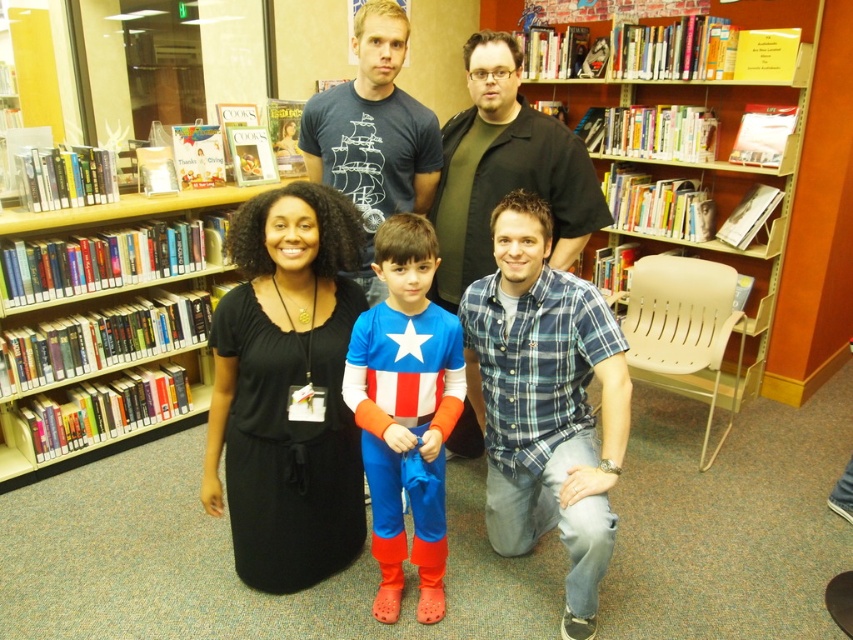
Who is more forward, (308, 387) or (514, 202)?

Positioned in front is point (514, 202).

Between black matte dress at center and blue plaid shirt at lower center, which one is positioned higher?

black matte dress at center is higher up.

Which is behind, point (288, 340) or point (608, 528)?

Positioned behind is point (288, 340).

Identify the location of black matte dress at center. The height and width of the screenshot is (640, 853). (287, 390).

In order to click on wooden bookshelf at center in this screenshot , I will do `click(769, 180)`.

Between wooden bookshelf at center and matte black shirt at center, which one is positioned lower?

matte black shirt at center is below.

Find the location of a particular element. wooden bookshelf at center is located at coordinates (769, 180).

Describe the element at coordinates (287, 390) in the screenshot. I see `black matte dress at center` at that location.

Does point (260, 253) lie behind point (386, 236)?

Yes, point (260, 253) is behind point (386, 236).

The image size is (853, 640). Describe the element at coordinates (287, 390) in the screenshot. I see `black matte dress at center` at that location.

Locate an element on the screen. Image resolution: width=853 pixels, height=640 pixels. black matte dress at center is located at coordinates (287, 390).